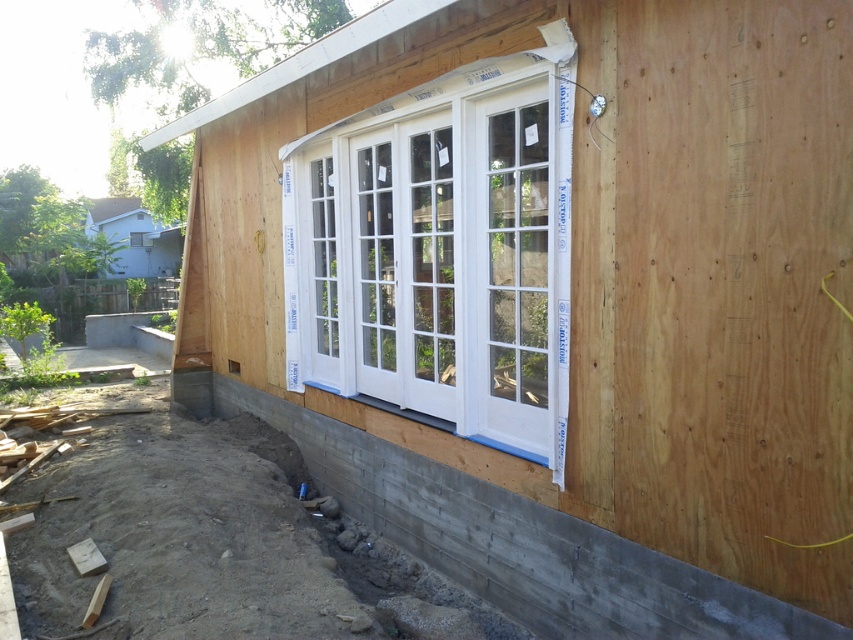
Question: Among these objects, which one is farthest from the camera?

Choices:
 (A) white painted wood bay window at center
 (B) concrete at lower left

Answer: (A)

Question: Can you confirm if white painted wood bay window at center is wider than concrete at lower left?

Choices:
 (A) no
 (B) yes

Answer: (A)

Question: Is white painted wood bay window at center behind concrete at lower left?

Choices:
 (A) no
 (B) yes

Answer: (B)

Question: Among these objects, which one is nearest to the camera?

Choices:
 (A) white painted wood bay window at center
 (B) concrete at lower left

Answer: (B)

Question: Where is white painted wood bay window at center located in relation to concrete at lower left in the image?

Choices:
 (A) left
 (B) right

Answer: (A)

Question: Which object appears farthest from the camera in this image?

Choices:
 (A) concrete at lower left
 (B) white painted wood bay window at center

Answer: (B)